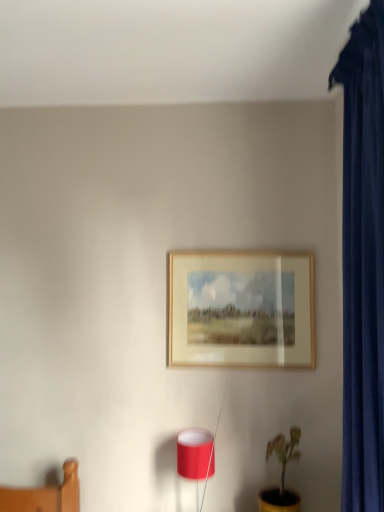
Question: Considering the relative sizes of yellow matte pot at lower right and matte red lampshade at lower center in the image provided, is yellow matte pot at lower right wider than matte red lampshade at lower center?

Choices:
 (A) yes
 (B) no

Answer: (A)

Question: Can you confirm if yellow matte pot at lower right is positioned to the left of matte red lampshade at lower center?

Choices:
 (A) no
 (B) yes

Answer: (A)

Question: Is yellow matte pot at lower right further to the viewer compared to matte red lampshade at lower center?

Choices:
 (A) no
 (B) yes

Answer: (A)

Question: Is yellow matte pot at lower right smaller than matte red lampshade at lower center?

Choices:
 (A) no
 (B) yes

Answer: (A)

Question: Is yellow matte pot at lower right turned away from matte red lampshade at lower center?

Choices:
 (A) yes
 (B) no

Answer: (B)

Question: Are yellow matte pot at lower right and matte red lampshade at lower center located far from each other?

Choices:
 (A) yes
 (B) no

Answer: (B)

Question: Considering the relative positions of wooden frame at center and matte red lampshade at lower center in the image provided, is wooden frame at center to the right of matte red lampshade at lower center from the viewer's perspective?

Choices:
 (A) no
 (B) yes

Answer: (B)

Question: From the image's perspective, is wooden frame at center beneath matte red lampshade at lower center?

Choices:
 (A) yes
 (B) no

Answer: (B)

Question: Considering the relative sizes of wooden frame at center and matte red lampshade at lower center in the image provided, is wooden frame at center shorter than matte red lampshade at lower center?

Choices:
 (A) yes
 (B) no

Answer: (B)

Question: Would you say wooden frame at center contains matte red lampshade at lower center?

Choices:
 (A) yes
 (B) no

Answer: (B)

Question: Is wooden frame at center further to camera compared to matte red lampshade at lower center?

Choices:
 (A) yes
 (B) no

Answer: (A)

Question: Are wooden frame at center and matte red lampshade at lower center far apart?

Choices:
 (A) no
 (B) yes

Answer: (A)

Question: Considering the relative sizes of matte red lampshade at lower center and wooden frame at center in the image provided, is matte red lampshade at lower center taller than wooden frame at center?

Choices:
 (A) yes
 (B) no

Answer: (B)